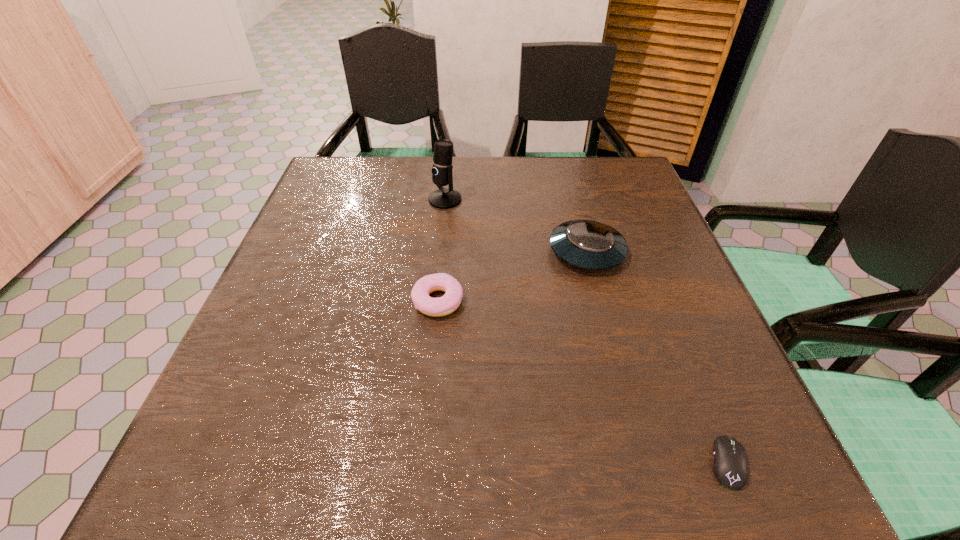
Where is `free space at the right edge of the desktop`? The width and height of the screenshot is (960, 540). free space at the right edge of the desktop is located at coordinates (677, 294).

Find the location of `free space at the far left corner`. free space at the far left corner is located at coordinates (359, 168).

The width and height of the screenshot is (960, 540). What are the coordinates of `free location at the far right corner` in the screenshot? It's located at (583, 179).

I want to click on free space at the near right corner of the desktop, so click(x=770, y=462).

Identify the location of vacant space in between the farthest object and the saucer. This screenshot has height=540, width=960. (516, 226).

The image size is (960, 540). I want to click on vacant space that's between the microphone and the saucer, so click(516, 226).

This screenshot has width=960, height=540. In order to click on empty space between the doughnut and the third nearest object in this screenshot , I will do `click(513, 276)`.

Find the location of a particular element. This screenshot has width=960, height=540. free spot between the nearest object and the farthest object is located at coordinates coord(587,332).

Image resolution: width=960 pixels, height=540 pixels. I want to click on free space between the farthest object and the doughnut, so (442, 250).

At what (x,y) coordinates should I click in order to perform the action: click on free space between the second shortest object and the microphone. Please return your answer as a coordinate pair (x, y). Looking at the image, I should click on (x=442, y=250).